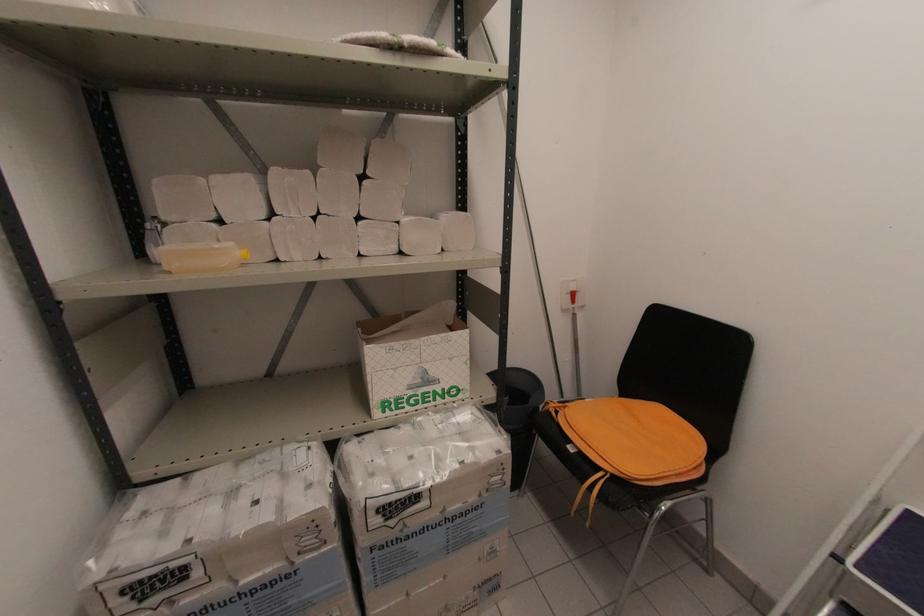
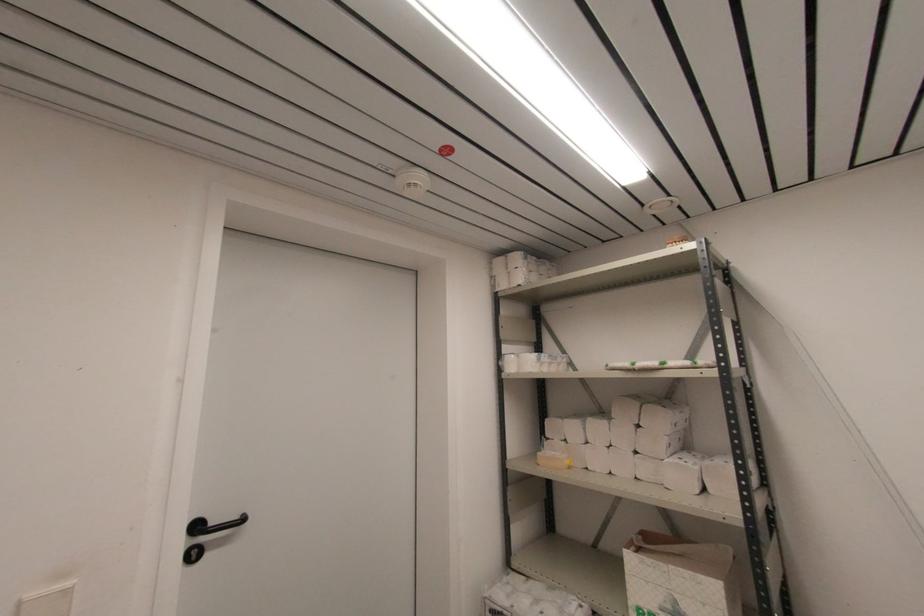
Locate, in the second image, the point that corresponds to the point at 359,217 in the first image.

(637, 453)